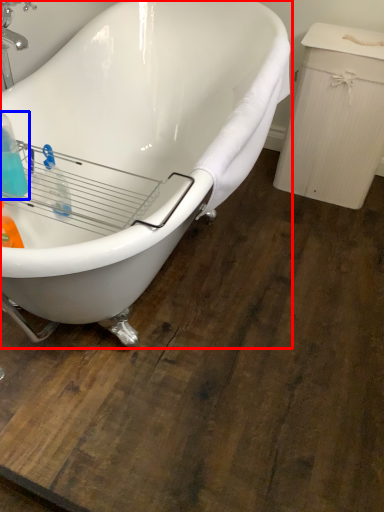
Question: Which object is further to the camera taking this photo, bathtub (highlighted by a red box) or cleaning product (highlighted by a blue box)?

Choices:
 (A) bathtub
 (B) cleaning product

Answer: (B)